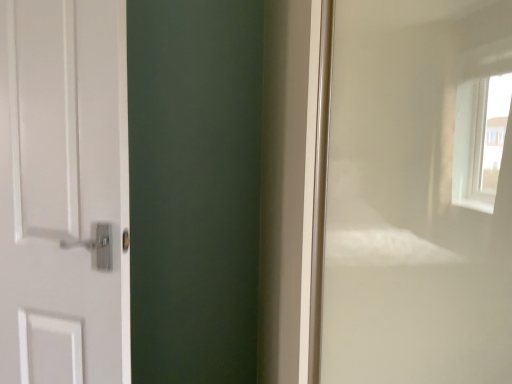
Image resolution: width=512 pixels, height=384 pixels. What do you see at coordinates (64, 192) in the screenshot?
I see `white matte door at left` at bounding box center [64, 192].

Where is `white matte door at left`? white matte door at left is located at coordinates (64, 192).

In order to face white matte door at left, should I rotate leftwards or rightwards?

You should rotate left by 25.567 degrees.

Identify the location of white glossy window frame at right. This screenshot has height=384, width=512. (419, 193).

Describe the element at coordinates (419, 193) in the screenshot. I see `white glossy window frame at right` at that location.

You are a GUI agent. You are given a task and a screenshot of the screen. Output one action in this format:
    pyautogui.click(x=<x>, y=<y>)
    Task: Click on the white matte door at left
    Image resolution: width=512 pixels, height=384 pixels.
    Given the screenshot: What is the action you would take?
    pyautogui.click(x=64, y=192)

In the scene shown: In the image, is white glossy window frame at right on the left side or the right side of white matte door at left?

From the image, it's evident that white glossy window frame at right is to the right of white matte door at left.

Which is in front, white glossy window frame at right or white matte door at left?

white glossy window frame at right is in front.

Is point (393, 95) farther from viewer compared to point (99, 36)?

That is False.

From the image's perspective, which object appears higher, white glossy window frame at right or white matte door at left?

white matte door at left appears higher in the image.

From a real-world perspective, is white glossy window frame at right positioned above or below white matte door at left?

Clearly, from a real-world perspective, white glossy window frame at right is below white matte door at left.

Can you confirm if white glossy window frame at right is wider than white matte door at left?

Correct, the width of white glossy window frame at right exceeds that of white matte door at left.

Does white glossy window frame at right have a lesser height compared to white matte door at left?

In fact, white glossy window frame at right may be taller than white matte door at left.

Considering the sizes of objects white glossy window frame at right and white matte door at left in the image provided, who is bigger, white glossy window frame at right or white matte door at left?

With larger size is white glossy window frame at right.

Is white glossy window frame at right spatially inside white matte door at left, or outside of it?

white glossy window frame at right is spatially situated outside white matte door at left.

Consider the image. Are white glossy window frame at right and white matte door at left beside each other?

No, white glossy window frame at right is not making contact with white matte door at left.

Based on the photo, is white matte door at left at the back of white glossy window frame at right?

No, white glossy window frame at right is not facing the opposite direction of white matte door at left.

What's the angular difference between white glossy window frame at right and white matte door at left's facing directions?

22.6 degrees.

This screenshot has height=384, width=512. Find the location of `window frame located in front of the white matte door at left`. window frame located in front of the white matte door at left is located at coordinates (x=419, y=193).

Visually, is white matte door at left positioned to the left or to the right of white glossy window frame at right?

white matte door at left is positioned on white glossy window frame at right's left side.

Is the position of white matte door at left more distant than that of white glossy window frame at right?

→ Yes, white matte door at left is further from the camera.

Considering the points (92, 331) and (333, 136), which point is in front, point (92, 331) or point (333, 136)?

The point (333, 136) is closer.

From the image's perspective, is white matte door at left under white glossy window frame at right?

No, from the image's perspective, white matte door at left is not below white glossy window frame at right.

From a real-world perspective, who is located lower, white matte door at left or white glossy window frame at right?

white glossy window frame at right is physically lower.

Is white matte door at left wider or thinner than white glossy window frame at right?

white matte door at left is thinner than white glossy window frame at right.

Which of these two, white matte door at left or white glossy window frame at right, stands shorter?

white matte door at left is shorter.

Who is bigger, white matte door at left or white glossy window frame at right?

Bigger between the two is white glossy window frame at right.

Is white matte door at left not inside white glossy window frame at right?

Absolutely, white matte door at left is external to white glossy window frame at right.

Is white matte door at left not close to white glossy window frame at right?

They are positioned close to each other.

Is white matte door at left looking in the opposite direction of white glossy window frame at right?

No, white matte door at left is not facing away from white glossy window frame at right.

How different are the orientations of white matte door at left and white glossy window frame at right in degrees?

The angle between the facing direction of white matte door at left and the facing direction of white glossy window frame at right is 22.6 degrees.

Where is `window frame lying in front of the white matte door at left`? This screenshot has height=384, width=512. window frame lying in front of the white matte door at left is located at coordinates (419, 193).

Where is `window frame on the right of white matte door at left`? Image resolution: width=512 pixels, height=384 pixels. window frame on the right of white matte door at left is located at coordinates (419, 193).

Image resolution: width=512 pixels, height=384 pixels. Find the location of `door lying behind the white glossy window frame at right`. door lying behind the white glossy window frame at right is located at coordinates (64, 192).